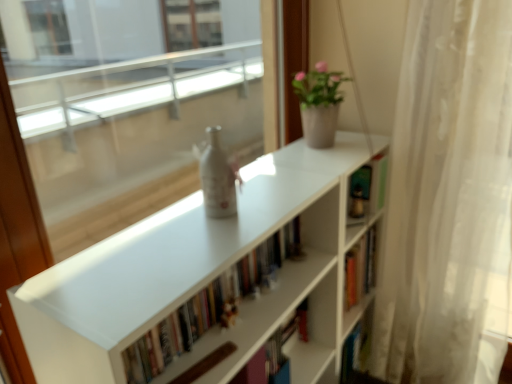
The image size is (512, 384). Find the location of `spots to the right of matte white pot at upper right`. spots to the right of matte white pot at upper right is located at coordinates (362, 142).